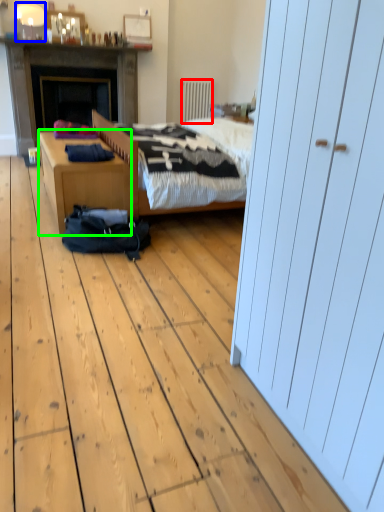
Question: Estimate the real-world distances between objects in this image. Which object is closer to radiator (highlighted by a red box), lamp (highlighted by a blue box) or desk (highlighted by a green box)?

Choices:
 (A) lamp
 (B) desk

Answer: (A)